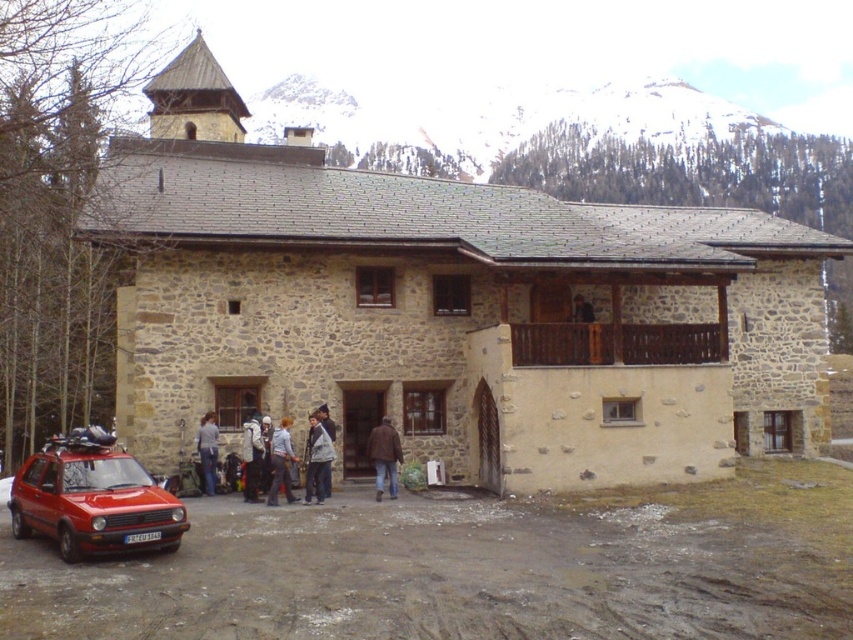
Consider the image. Can you confirm if gray woolen jacket at center is positioned to the left of white snowboard at center?

No, gray woolen jacket at center is not to the left of white snowboard at center.

Is gray woolen jacket at center bigger than white snowboard at center?

Yes.

Is point (316, 472) in front of point (257, 429)?

Yes.

What are the coordinates of `gray woolen jacket at center` in the screenshot? It's located at (317, 460).

Who is taller, stone church at center or shiny red car at lower left?

stone church at center is taller.

Based on the photo, does stone church at center come behind shiny red car at lower left?

That is True.

Is point (820, 337) in front of point (103, 500)?

That is False.

Locate an element on the screen. The width and height of the screenshot is (853, 640). stone church at center is located at coordinates (450, 308).

Is the position of shiny red car at lower left more distant than that of gray woolen jacket at center?

No, shiny red car at lower left is closer to the viewer.

Consider the image. Is shiny red car at lower left to the right of gray woolen jacket at center from the viewer's perspective?

In fact, shiny red car at lower left is to the left of gray woolen jacket at center.

Who is more forward, (90, 547) or (317, 433)?

Point (90, 547)

Locate an element on the screen. This screenshot has height=640, width=853. shiny red car at lower left is located at coordinates [x=93, y=499].